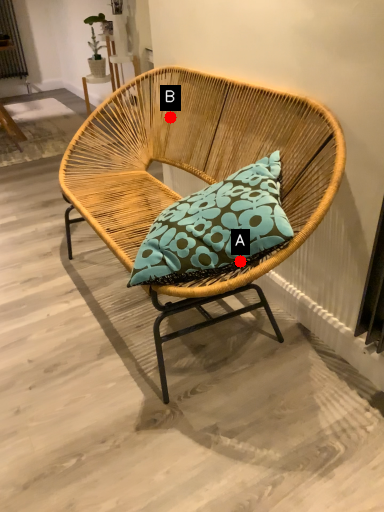
Question: Two points are circled on the image, labeled by A and B beside each circle. Which point is farther to the camera?

Choices:
 (A) A is further
 (B) B is further

Answer: (B)